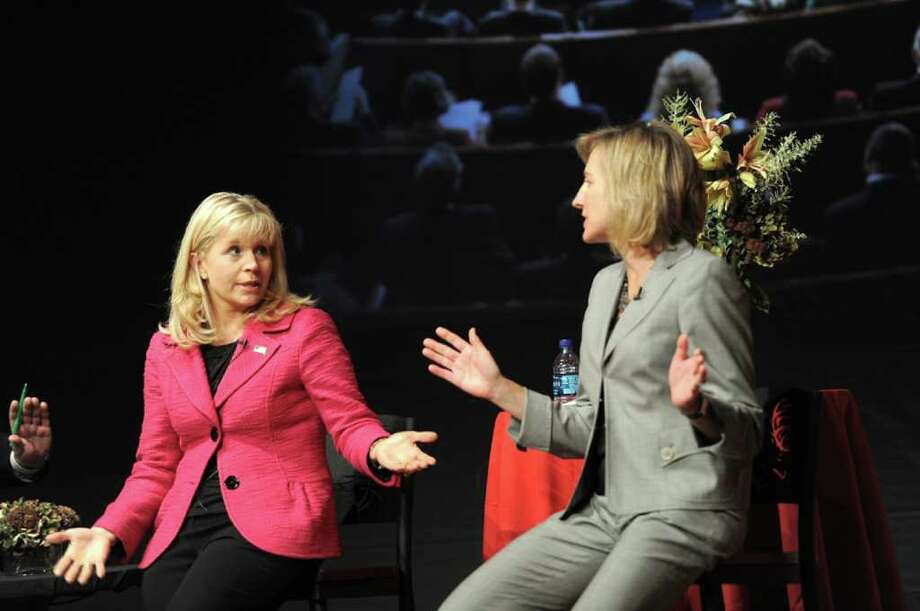
You are a GUI agent. You are given a task and a screenshot of the screen. Output one action in this format:
    pyautogui.click(x=<x>, y=<y>)
    Task: Click on the coat
    The height and width of the screenshot is (611, 920).
    Given the screenshot: What is the action you would take?
    [x=293, y=408], [x=584, y=348], [x=616, y=360]